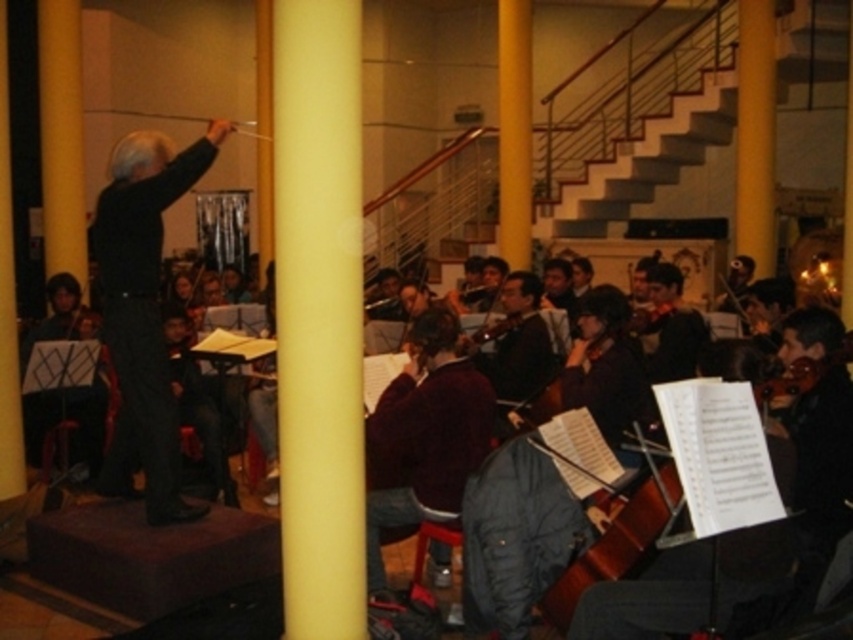
Question: Observing the image, what is the correct spatial positioning of black matte conductor at center in reference to shiny brown violin at lower right?

Choices:
 (A) below
 (B) above

Answer: (B)

Question: Which point appears closest to the camera in this image?

Choices:
 (A) (396, 419)
 (B) (805, 369)
 (C) (334, 145)
 (D) (595, 208)

Answer: (C)

Question: Does black matte conductor at center appear on the right side of white concrete stairs at upper center?

Choices:
 (A) yes
 (B) no

Answer: (B)

Question: Which of these objects is positioned farthest from the maroon sweater at center?

Choices:
 (A) white concrete stairs at upper center
 (B) shiny brown violin at lower right
 (C) yellow matte pole at center
 (D) black matte conductor at center

Answer: (A)

Question: Considering the relative positions of yellow matte pole at center and maroon sweater at center in the image provided, where is yellow matte pole at center located with respect to maroon sweater at center?

Choices:
 (A) above
 (B) below

Answer: (A)

Question: Which of the following is the farthest from the observer?

Choices:
 (A) (720, 81)
 (B) (421, 349)

Answer: (A)